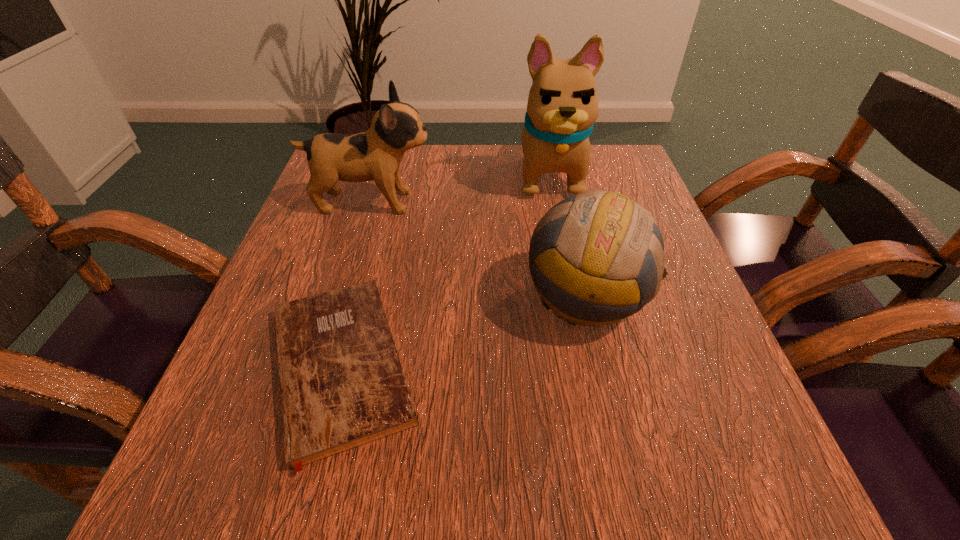
Identify the location of free space that satisfies the following two spatial constraints: 1. on the face of the second shortest object; 2. on the left side of the right puppy. The height and width of the screenshot is (540, 960). (574, 298).

Locate an element on the screen. This screenshot has height=540, width=960. free space that satisfies the following two spatial constraints: 1. at the face of the left puppy; 2. on the left side of the volleyball is located at coordinates (343, 298).

At what (x,y) coordinates should I click in order to perform the action: click on free space that satisfies the following two spatial constraints: 1. at the face of the shorter puppy; 2. on the back side of the third tallest object. Please return your answer as a coordinate pair (x, y). This screenshot has width=960, height=540. Looking at the image, I should click on (343, 298).

The height and width of the screenshot is (540, 960). I want to click on vacant space that satisfies the following two spatial constraints: 1. on the back side of the Bible; 2. at the face of the left puppy, so click(x=384, y=202).

The height and width of the screenshot is (540, 960). I want to click on free point that satisfies the following two spatial constraints: 1. at the face of the third shortest object; 2. on the right side of the Bible, so click(323, 366).